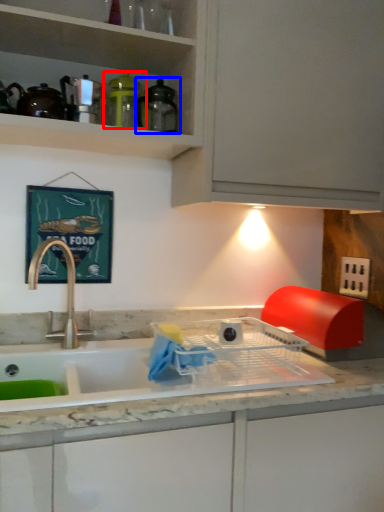
Question: Which object appears closest to the camera in this image, appliance (highlighted by a red box) or appliance (highlighted by a blue box)?

Choices:
 (A) appliance
 (B) appliance

Answer: (B)